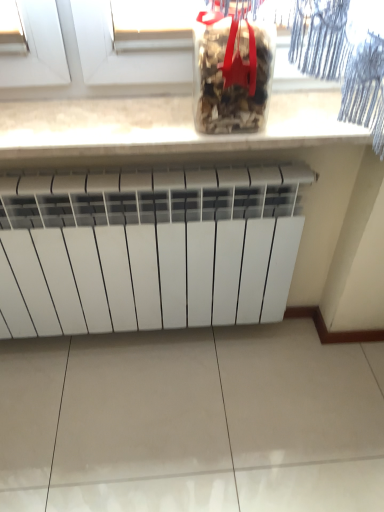
Question: Are transparent plastic container at upper center and white matte radiator at center far apart?

Choices:
 (A) no
 (B) yes

Answer: (A)

Question: Is transparent plastic container at upper center taller than white matte radiator at center?

Choices:
 (A) yes
 (B) no

Answer: (B)

Question: Is transparent plastic container at upper center not inside white matte radiator at center?

Choices:
 (A) no
 (B) yes

Answer: (B)

Question: From a real-world perspective, is transparent plastic container at upper center on white matte radiator at center?

Choices:
 (A) yes
 (B) no

Answer: (A)

Question: From a real-world perspective, is transparent plastic container at upper center physically below white matte radiator at center?

Choices:
 (A) yes
 (B) no

Answer: (B)

Question: Is transparent plastic container at upper center next to white matte radiator at center and touching it?

Choices:
 (A) no
 (B) yes

Answer: (A)

Question: Can transparent plastic container at upper center be found inside white stone countertop at upper center?

Choices:
 (A) yes
 (B) no

Answer: (B)

Question: Is the depth of white stone countertop at upper center greater than that of transparent plastic container at upper center?

Choices:
 (A) yes
 (B) no

Answer: (A)

Question: From the image's perspective, is white stone countertop at upper center above transparent plastic container at upper center?

Choices:
 (A) no
 (B) yes

Answer: (A)

Question: Does white stone countertop at upper center have a greater width compared to transparent plastic container at upper center?

Choices:
 (A) no
 (B) yes

Answer: (B)

Question: Can we say white stone countertop at upper center lies outside transparent plastic container at upper center?

Choices:
 (A) yes
 (B) no

Answer: (A)

Question: Can you confirm if white stone countertop at upper center is positioned to the right of transparent plastic container at upper center?

Choices:
 (A) no
 (B) yes

Answer: (A)

Question: Can you confirm if transparent plastic container at upper center is positioned to the right of white stone countertop at upper center?

Choices:
 (A) no
 (B) yes

Answer: (B)